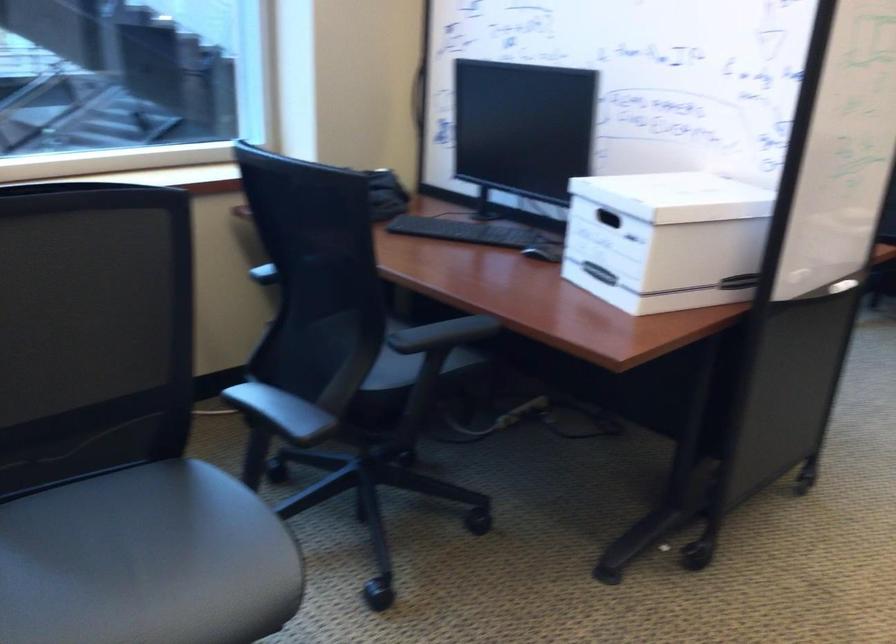
This screenshot has height=644, width=896. Describe the element at coordinates (544, 251) in the screenshot. I see `a computer mouse` at that location.